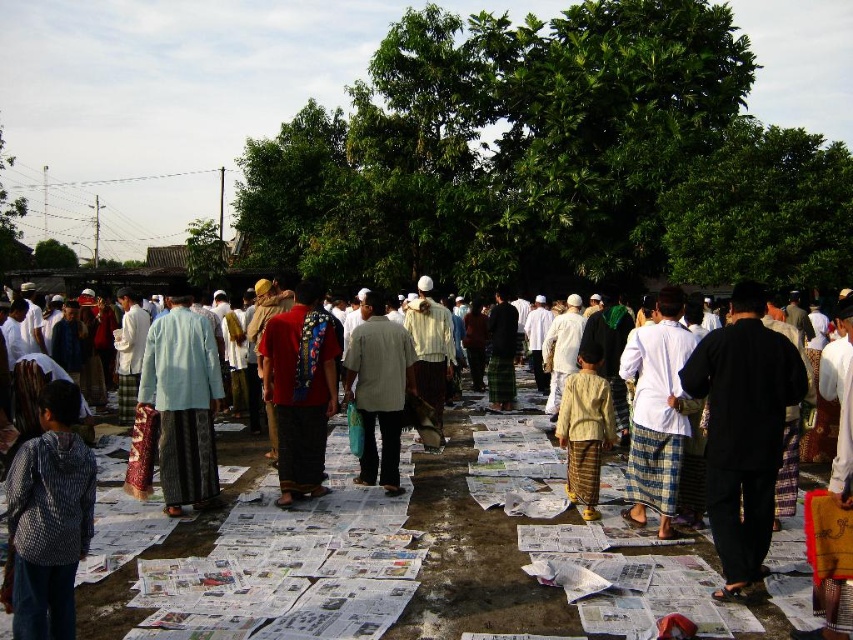
You are organizing a community event and need to store items in the red fabric bag at center and the light gray fabric shirt at center. Which item can hold more items based on their sizes?

The red fabric bag at center has a larger size compared to the light gray fabric shirt at center, so it can hold more items.

You are organizing a small event and need to place a table between the checkered fabric shirt at lower left and the light blue fabric at center. The table requires 3 meters of space. Is there enough space between them?

The distance between the checkered fabric shirt at lower left and the light blue fabric at center is 6.80 meters, so yes, there is enough space to place the table between them since 6.80 meters is more than the required 3 meters.

In the scene shown: You are a photographer trying to capture a photo of the communal prayer scene. You want to ensure both the checkered fabric shirt at lower left and the light blue fabric at center are clearly visible in your shot. Given their height difference, where should you position the camera to best include both?

The checkered fabric shirt at lower left is shorter than the light blue fabric at center. To capture both clearly, position the camera at a lower angle so the shorter checkered fabric shirt at lower left is visible while still framing the taller light blue fabric at center appropriately.